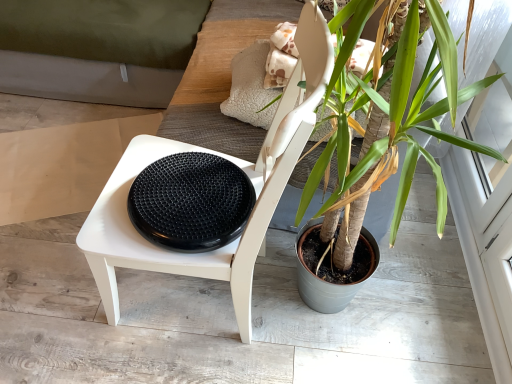
Image resolution: width=512 pixels, height=384 pixels. I want to click on free point to the right of white matte chair at center, so click(340, 320).